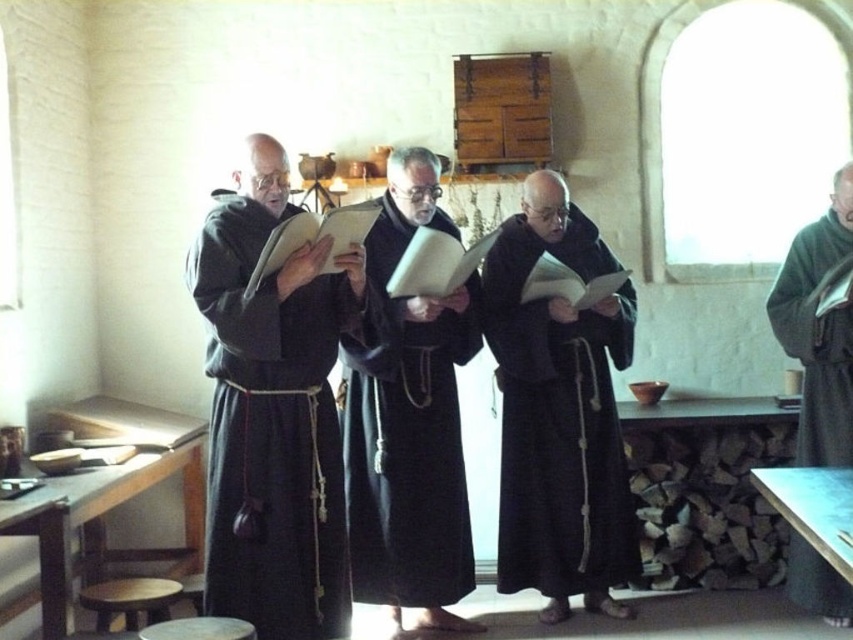
Does point (422, 548) come farther from viewer compared to point (840, 618)?

No.

Is point (393, 588) closer to viewer compared to point (836, 248)?

Yes, it is.

The width and height of the screenshot is (853, 640). I want to click on dark matte robe at center, so click(405, 440).

Which is in front, point (282, 532) or point (807, 445)?

Positioned in front is point (282, 532).

Looking at this image, can you confirm if black matte robe at left is taller than dark woolen robe at right?

Indeed, black matte robe at left has a greater height compared to dark woolen robe at right.

Is point (244, 220) positioned after point (793, 296)?

No.

Where is `black matte robe at left`? Image resolution: width=853 pixels, height=640 pixels. black matte robe at left is located at coordinates (271, 429).

Is black matte robe at left behind black matte robe at center?

No, it is not.

Does black matte robe at left appear on the right side of black matte robe at center?

No, black matte robe at left is not to the right of black matte robe at center.

Is point (335, 330) more distant than point (630, 516)?

No, it is not.

This screenshot has height=640, width=853. I want to click on black matte robe at left, so click(271, 429).